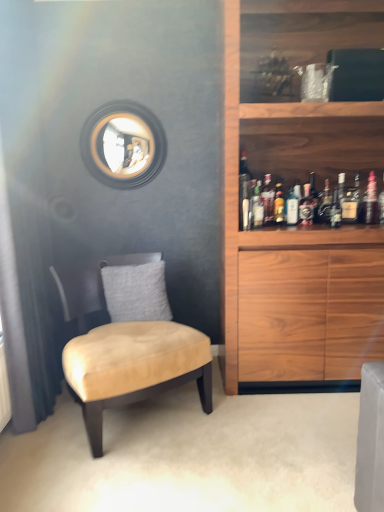
Describe the element at coordinates (307, 205) in the screenshot. The height and width of the screenshot is (512, 384). I see `translucent glass bottle at upper right, which is the sixth bottle from left to right` at that location.

Identify the location of clear glass bottle at upper right, which ranks as the first bottle in left-to-right order. This screenshot has width=384, height=512. (244, 193).

How much space does translucent glass bottle at upper right, positioned as the second bottle in right-to-left order, occupy vertically?

8.79 inches.

Locate an element on the screen. translucent glass bottle at upper right, positioned as the second bottle in right-to-left order is located at coordinates (336, 210).

Where is `translucent glass bottle at shelf center, the fourth bottle viewed from the left`? Image resolution: width=384 pixels, height=512 pixels. translucent glass bottle at shelf center, the fourth bottle viewed from the left is located at coordinates (279, 204).

Find the location of a particular element. The image size is (384, 512). suede-like beige chair at left is located at coordinates (134, 367).

Which is more to the left, wooden-framed mirror at upper left or translucent glass bottle at shelf center, which is the sixth bottle in right-to-left order?

wooden-framed mirror at upper left.

Is wooden-framed mirror at upper left positioned beyond the bounds of translucent glass bottle at shelf center, which is the sixth bottle in right-to-left order?

Indeed, wooden-framed mirror at upper left is completely outside translucent glass bottle at shelf center, which is the sixth bottle in right-to-left order.

In order to click on the 9th bottle below the wooden-framed mirror at upper left (from a real-world perspective) in this screenshot , I will do `click(279, 204)`.

From a real-world perspective, is translucent glass bottle at upper right, the 2th bottle positioned from the left, physically located above or below translucent glass bottle at upper right, the 4th bottle when ordered from right to left?

From a real-world perspective, translucent glass bottle at upper right, the 2th bottle positioned from the left, is physically above translucent glass bottle at upper right, the 4th bottle when ordered from right to left.

Which is correct: translucent glass bottle at upper right, the 2th bottle positioned from the left, is inside translucent glass bottle at upper right, which is the sixth bottle from left to right, or outside of it?

translucent glass bottle at upper right, the 2th bottle positioned from the left, is not inside translucent glass bottle at upper right, which is the sixth bottle from left to right, it's outside.

Considering the sizes of objects translucent glass bottle at upper right, the 2th bottle positioned from the left, and translucent glass bottle at upper right, which is the sixth bottle from left to right, in the image provided, who is bigger, translucent glass bottle at upper right, the 2th bottle positioned from the left, or translucent glass bottle at upper right, which is the sixth bottle from left to right,?

translucent glass bottle at upper right, which is the sixth bottle from left to right.

Between wooden-framed mirror at upper left and translucent glass bottle at upper right, acting as the ninth bottle starting from the left, which one has larger width?

Wider between the two is wooden-framed mirror at upper left.

Do you think wooden-framed mirror at upper left is within translucent glass bottle at upper right, acting as the ninth bottle starting from the left, or outside of it?

wooden-framed mirror at upper left is not inside translucent glass bottle at upper right, acting as the ninth bottle starting from the left, it's outside.

Looking at the image, does wooden-framed mirror at upper left seem bigger or smaller compared to translucent glass bottle at upper right, the first bottle from the right?

In the image, wooden-framed mirror at upper left appears to be larger than translucent glass bottle at upper right, the first bottle from the right.

This screenshot has width=384, height=512. Find the location of `the 1st bottle in front of the wooden-framed mirror at upper left, starting your count from the anchor`. the 1st bottle in front of the wooden-framed mirror at upper left, starting your count from the anchor is located at coordinates (371, 200).

Choose the correct answer: Is wooden-framed mirror at upper left inside translucent glass bottle at center, which appears as the fifth bottle when viewed from the right, or outside it?

wooden-framed mirror at upper left is outside translucent glass bottle at center, which appears as the fifth bottle when viewed from the right.

From a real-world perspective, is wooden-framed mirror at upper left over translucent glass bottle at center, positioned as the fifth bottle in left-to-right order?

Indeed, from a real-world perspective, wooden-framed mirror at upper left stands above translucent glass bottle at center, positioned as the fifth bottle in left-to-right order.

Image resolution: width=384 pixels, height=512 pixels. What are the coordinates of `bottle that is the 5th one when counting rightward from the wooden-framed mirror at upper left` in the screenshot? It's located at (293, 205).

Based on the photo, measure the distance between wooden-framed mirror at upper left and translucent glass bottle at center, positioned as the fifth bottle in left-to-right order.

7.28 feet.

In the image, is translucent glass bottle at upper right, the 2th bottle positioned from the left, positioned in front of or behind gray fuzzy pillow at center?

Clearly, translucent glass bottle at upper right, the 2th bottle positioned from the left, is behind gray fuzzy pillow at center.

This screenshot has width=384, height=512. What are the coordinates of `pillow below the translucent glass bottle at upper right, acting as the 8th bottle starting from the right (from the image's perspective)` in the screenshot? It's located at (136, 292).

How many degrees apart are the facing directions of translucent glass bottle at upper right, the 2th bottle positioned from the left, and gray fuzzy pillow at center?

translucent glass bottle at upper right, the 2th bottle positioned from the left, and gray fuzzy pillow at center are facing 8.11 degrees away from each other.

From a real-world perspective, is translucent glass bottle at upper right, the 2th bottle positioned from the left, beneath gray fuzzy pillow at center?

No, from a real-world perspective, translucent glass bottle at upper right, the 2th bottle positioned from the left, is not under gray fuzzy pillow at center.

Choose the correct answer: Is translucent glass bottle at upper right, which is the 3th bottle from left to right, inside gray fuzzy pillow at center or outside it?

translucent glass bottle at upper right, which is the 3th bottle from left to right, cannot be found inside gray fuzzy pillow at center.

Which of these two, translucent glass bottle at upper right, which appears as the 7th bottle when viewed from the right, or gray fuzzy pillow at center, is bigger?

With larger size is gray fuzzy pillow at center.

From the image's perspective, is translucent glass bottle at upper right, which appears as the 7th bottle when viewed from the right, positioned above or below gray fuzzy pillow at center?

From the image's perspective, translucent glass bottle at upper right, which appears as the 7th bottle when viewed from the right, appears above gray fuzzy pillow at center.

From a real-world perspective, is translucent glass bottle at upper right, which is the 3th bottle from left to right, over gray fuzzy pillow at center?

Yes.

Can we say translucent glass bottle at upper right, which is the eighth bottle from left to right, lies outside suede-like beige chair at left?

Indeed, translucent glass bottle at upper right, which is the eighth bottle from left to right, is completely outside suede-like beige chair at left.

Which object is further away from the camera, translucent glass bottle at upper right, which is the eighth bottle from left to right, or suede-like beige chair at left?

translucent glass bottle at upper right, which is the eighth bottle from left to right, is further from the camera.

Is translucent glass bottle at upper right, which is the eighth bottle from left to right, with suede-like beige chair at left?

No, translucent glass bottle at upper right, which is the eighth bottle from left to right, is not in contact with suede-like beige chair at left.

The width and height of the screenshot is (384, 512). Identify the location of the 5th bottle in front of the wooden-framed mirror at upper left, starting your count from the anchor. (279, 204).

Locate an element on the screen. Image resolution: width=384 pixels, height=512 pixels. bottle that is the 4th object located above the translucent glass bottle at upper right, acting as the 8th bottle starting from the right (from the image's perspective) is located at coordinates (307, 205).

Considering their positions, is translucent glass bottle at upper right, positioned as the second bottle in right-to-left order, positioned further to wooden-framed mirror at upper left than translucent glass bottle at center, positioned as the fifth bottle in left-to-right order?

translucent glass bottle at upper right, positioned as the second bottle in right-to-left order, is further to wooden-framed mirror at upper left.

Estimate the real-world distances between objects in this image. Which object is closer to translucent glass bottle at upper right, placed as the third bottle when sorted from right to left, translucent glass bottle at upper right, acting as the 8th bottle starting from the right, or translucent glass bottle at shelf center, the fourth bottle viewed from the left?

translucent glass bottle at shelf center, the fourth bottle viewed from the left, lies closer to translucent glass bottle at upper right, placed as the third bottle when sorted from right to left, than the other object.

Estimate the real-world distances between objects in this image. Which object is further from clear glass bottle at upper right, positioned as the ninth bottle in right-to-left order, translucent glass bottle at upper right, placed as the third bottle when sorted from right to left, or wooden-framed mirror at upper left?

wooden-framed mirror at upper left lies further to clear glass bottle at upper right, positioned as the ninth bottle in right-to-left order, than the other object.

Looking at this image, considering their positions, is wooden-framed mirror at upper left positioned closer to translucent glass bottle at center, positioned as the fifth bottle in left-to-right order, than translucent glass bottle at upper right, the first bottle from the right?

translucent glass bottle at upper right, the first bottle from the right, is positioned closer to the anchor translucent glass bottle at center, positioned as the fifth bottle in left-to-right order.

Based on their spatial positions, is translucent glass bottle at upper right, acting as the ninth bottle starting from the left, or gray fuzzy pillow at center closer to suede-like beige chair at left?

gray fuzzy pillow at center lies closer to suede-like beige chair at left than the other object.

Which object lies nearer to the anchor point translucent glass bottle at upper right, which is the sixth bottle from left to right, gray fuzzy pillow at center or suede-like beige chair at left?

Among the two, gray fuzzy pillow at center is located nearer to translucent glass bottle at upper right, which is the sixth bottle from left to right.

In the scene shown: From the image, which object appears to be farther from clear glass bottle at upper right, which ranks as the first bottle in left-to-right order, translucent glass bottle at upper right, which is the eighth bottle from left to right, or translucent glass bottle at upper right, acting as the ninth bottle starting from the left?

Based on the image, translucent glass bottle at upper right, acting as the ninth bottle starting from the left, appears to be further to clear glass bottle at upper right, which ranks as the first bottle in left-to-right order.

Looking at the image, which one is located further to clear glass bottle at upper right, positioned as the ninth bottle in right-to-left order, suede-like beige chair at left or wooden-framed mirror at upper left?

The object further to clear glass bottle at upper right, positioned as the ninth bottle in right-to-left order, is wooden-framed mirror at upper left.

Locate an element on the screen. bottle between gray fuzzy pillow at center and translucent glass bottle at upper right, the 2th bottle positioned from the left, from left to right is located at coordinates (244, 193).

You are a GUI agent. You are given a task and a screenshot of the screen. Output one action in this format:
    pyautogui.click(x=<x>, y=<y>)
    Task: Click on the chair between wooden-framed mirror at upper left and translucent glass bottle at upper right, the 4th bottle when ordered from right to left, from left to right
    This screenshot has height=512, width=384.
    Given the screenshot: What is the action you would take?
    pyautogui.click(x=134, y=367)

Image resolution: width=384 pixels, height=512 pixels. I want to click on bottle between translucent glass bottle at shelf center, which is the sixth bottle in right-to-left order, and translucent glass bottle at upper right, the 4th bottle when ordered from right to left, so click(x=293, y=205).

Where is `pillow situated between suede-like beige chair at left and translucent glass bottle at upper right, the first bottle from the right, from left to right`? The width and height of the screenshot is (384, 512). pillow situated between suede-like beige chair at left and translucent glass bottle at upper right, the first bottle from the right, from left to right is located at coordinates (136, 292).